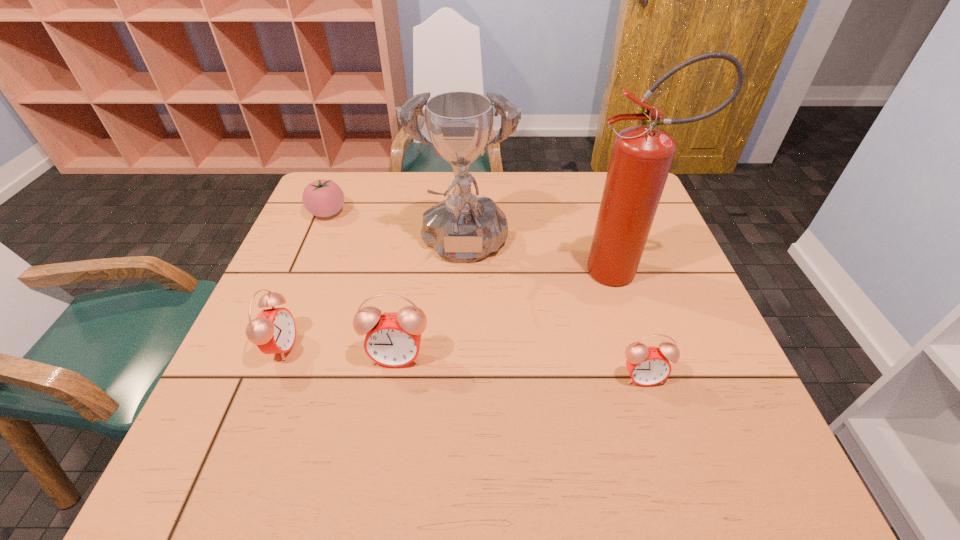
You are a GUI agent. You are given a task and a screenshot of the screen. Output one action in this format:
    pyautogui.click(x=<x>, y=<y>)
    Task: Click on the leftmost alarm clock
    This screenshot has width=960, height=540.
    Given the screenshot: What is the action you would take?
    pyautogui.click(x=273, y=330)

The height and width of the screenshot is (540, 960). Identify the location of the second tallest alarm clock. (273, 330).

Find the location of a particular element. the second alarm clock from right to left is located at coordinates (392, 339).

You are a GUI agent. You are given a task and a screenshot of the screen. Output one action in this format:
    pyautogui.click(x=<x>, y=<y>)
    Task: Click on the rightmost alarm clock
    The image size is (960, 540).
    Given the screenshot: What is the action you would take?
    647,365

I want to click on the shortest alarm clock, so click(647, 365).

What are the coordinates of `the tallest object` in the screenshot? It's located at (642, 155).

Identify the location of the fifth shortest object. This screenshot has height=540, width=960. click(463, 228).

At what (x,y) coordinates should I click in order to perform the action: click on tomato. Please return your answer as a coordinate pair (x, y). The width and height of the screenshot is (960, 540). Looking at the image, I should click on (323, 198).

This screenshot has width=960, height=540. Find the location of `free location located 0.110m on the clock face of the leftmost alarm clock`. free location located 0.110m on the clock face of the leftmost alarm clock is located at coordinates (346, 346).

The image size is (960, 540). Identify the location of free space located 0.050m on the clock face of the second alarm clock from left to right. (391, 390).